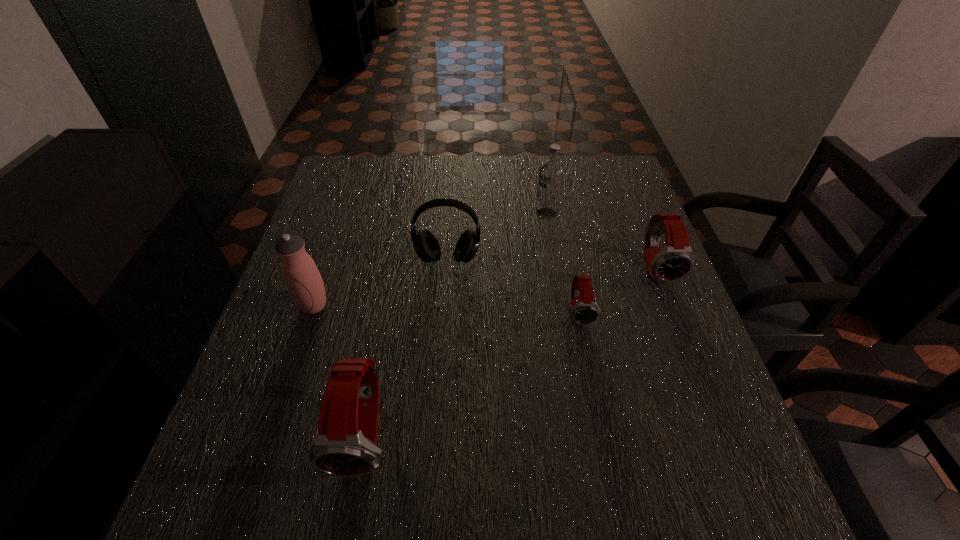
Where is `vacant area at the near edge of the desktop`? vacant area at the near edge of the desktop is located at coordinates point(419,430).

In the image, there is a desktop. Identify the location of vacant space at the left edge. The height and width of the screenshot is (540, 960). (355, 219).

This screenshot has width=960, height=540. I want to click on free space at the right edge of the desktop, so click(652, 346).

I want to click on free spot at the far right corner of the desktop, so (575, 160).

Identify the location of free region at the near right corner. Image resolution: width=960 pixels, height=540 pixels. (714, 414).

What are the coordinates of `vacant area between the headset and the rightmost object` in the screenshot? It's located at (552, 264).

The height and width of the screenshot is (540, 960). What are the coordinates of `blank region between the rightmost watch and the second watch from left to right` in the screenshot? It's located at (618, 291).

Find the location of a particular element. The image size is (960, 540). vacant region between the leftmost watch and the headset is located at coordinates [x=407, y=347].

The image size is (960, 540). Find the location of `free spot between the headset and the vodka`. free spot between the headset and the vodka is located at coordinates (497, 237).

Where is `vacant space that is in between the headset and the second watch from right to left`? The height and width of the screenshot is (540, 960). vacant space that is in between the headset and the second watch from right to left is located at coordinates (514, 286).